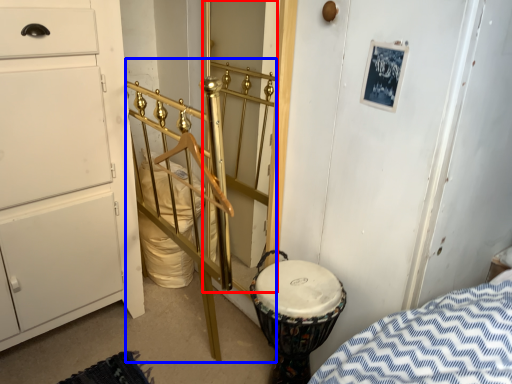
Question: Which object is further to the camera taking this photo, door (highlighted by a red box) or rail (highlighted by a blue box)?

Choices:
 (A) door
 (B) rail

Answer: (A)